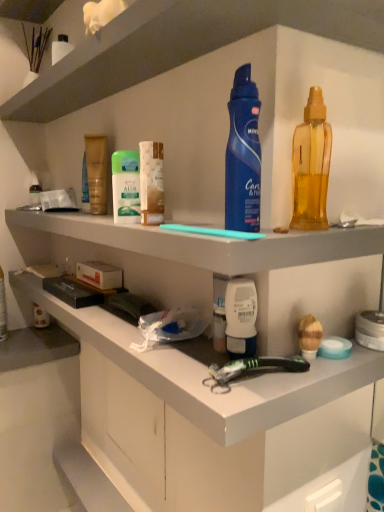
Question: Does point (87, 76) appear closer or farther from the camera than point (215, 371)?

Choices:
 (A) farther
 (B) closer

Answer: (A)

Question: From their relative heights in the image, would you say white plastic shelf at upper center, which is the 1th shelf from top to bottom, is taller or shorter than black plastic toothbrush at lower center?

Choices:
 (A) tall
 (B) short

Answer: (A)

Question: Which object is positioned closest to the white plastic shelf at upper center, which is the 3th shelf in bottom-to-top order?

Choices:
 (A) white matte drawer at lower center
 (B) translucent yellow liquid at right, acting as the second cleaning product starting from the left
 (C) translucent plastic deodorant stick at center, which ranks as the third toiletry in left-to-right order
 (D) translucent golden lotion at center, positioned as the 3th toiletry in front-to-back order
 (E) metallic silver tube at left, placed as the first toiletry when sorted from left to right

Answer: (C)

Question: Based on their relative distances, which object is farther from the white plastic toothpaste tube at center, arranged as the fourth toiletry when viewed from the back?

Choices:
 (A) white matte cabinet at lower center, marked as the 1th shelf in a bottom-to-top arrangement
 (B) translucent yellow liquid at right, which is the first cleaning product in right-to-left order
 (C) metallic silver tube at left, which is the 4th toiletry from front to back
 (D) white plastic shelf at upper center, which is the 1th shelf from top to bottom
 (E) blue matte deodorant at center, acting as the 2th cleaning product starting from the right

Answer: (C)